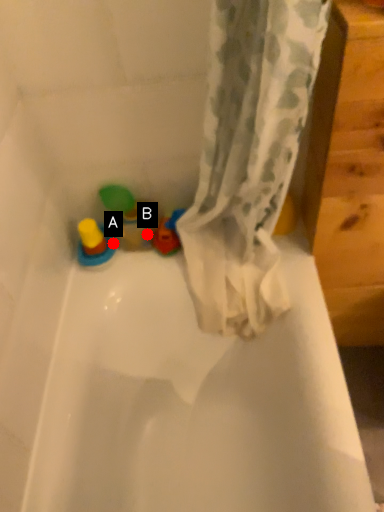
Question: Two points are circled on the image, labeled by A and B beside each circle. Which of the following is the closest to the observer?

Choices:
 (A) A is closer
 (B) B is closer

Answer: (B)